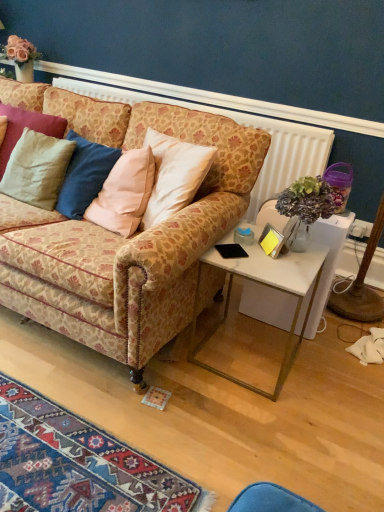
This screenshot has width=384, height=512. In order to click on free spot below white marble side table at right (from a real-world perspective) in this screenshot , I will do `click(245, 353)`.